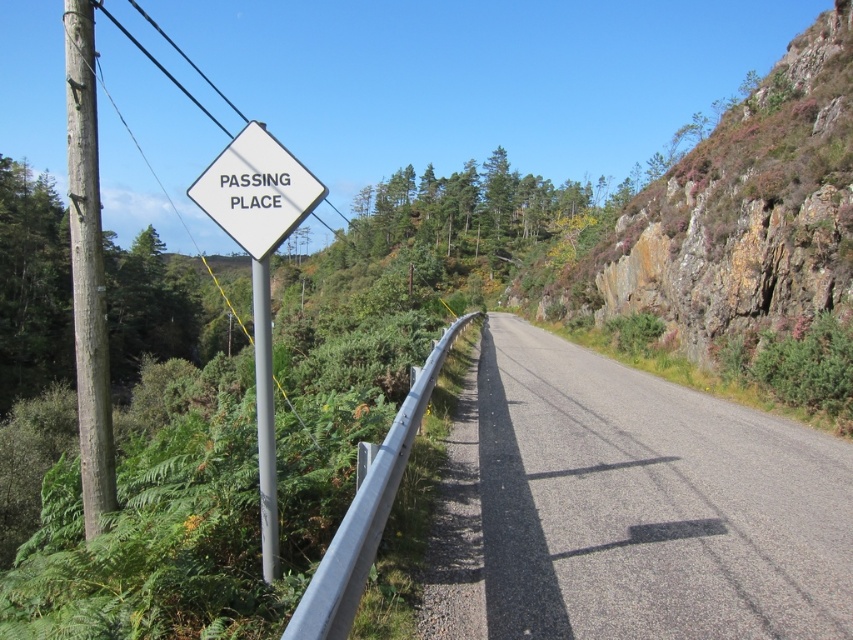
You are driving a car and see the silver metallic rail at center and the silver metallic pole at left. Which object is closer to your car?

The silver metallic rail at center is closer to your car because it is in front of the silver metallic pole at left.

You are a delivery driver navigating a rural road and see the point marked at coordinates (259, 268). What object is located at that point?

The white plastic sign at center left is located at point (259, 268).